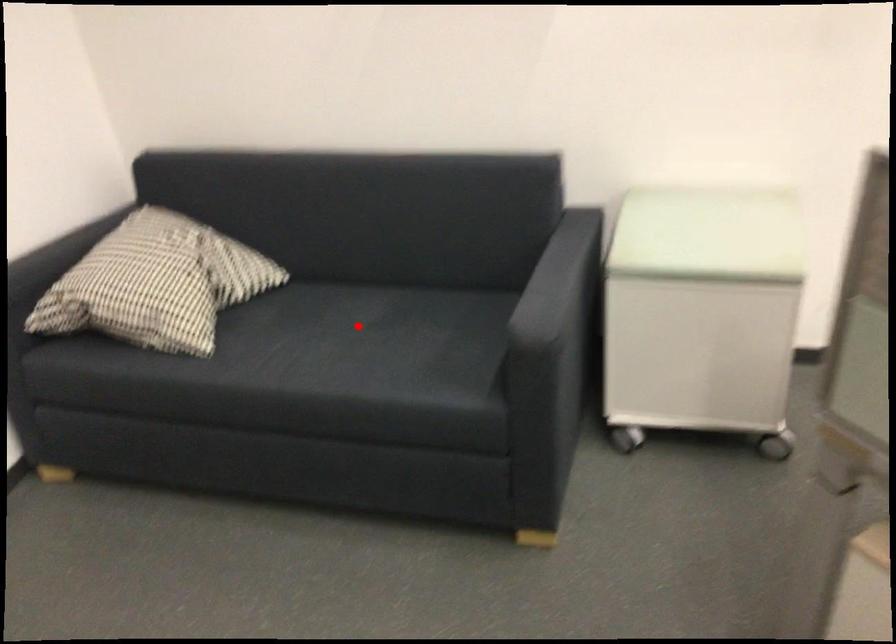
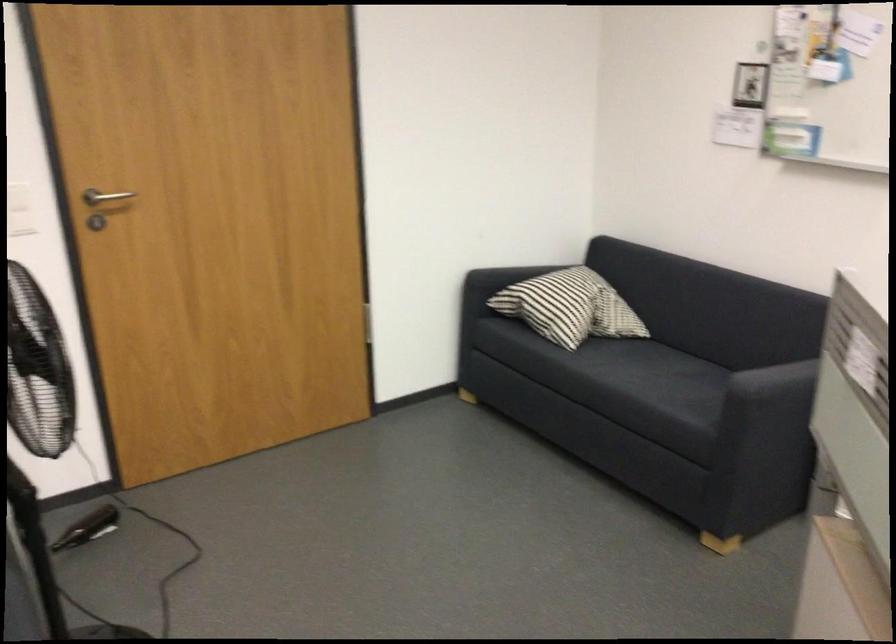
The point at the highlighted location is marked in the first image. Where is the corresponding point in the second image?

(668, 370)